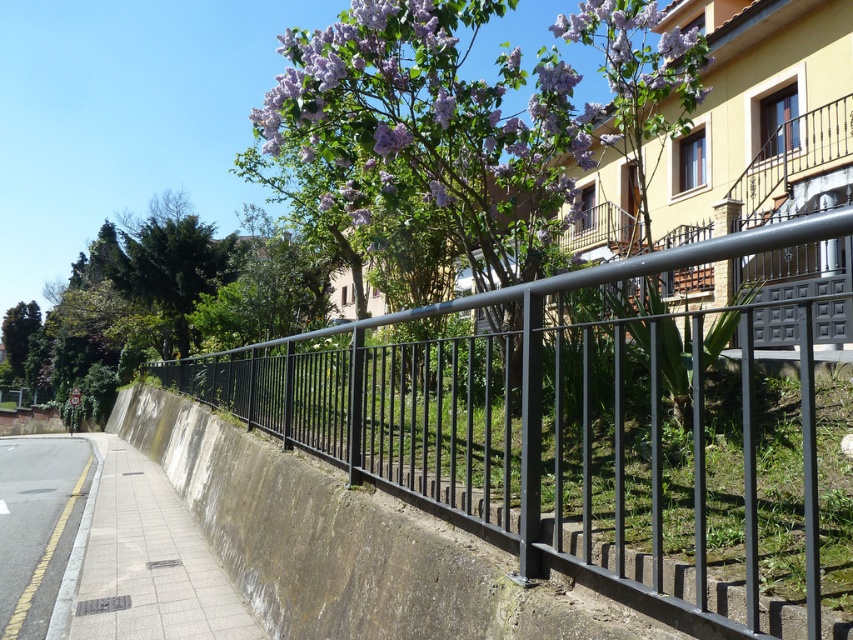
Question: Does purple flowering tree at center have a greater width compared to gray concrete pavement at lower left?

Choices:
 (A) no
 (B) yes

Answer: (B)

Question: Estimate the real-world distances between objects in this image. Which object is closer to the purple matte flower at upper center?

Choices:
 (A) gray concrete pavement at lower left
 (B) black metal fence at center
 (C) purple flowering tree at center

Answer: (B)

Question: Can you confirm if gray concrete pavement at lower left is positioned to the right of yellow painted concrete pavement at lower left?

Choices:
 (A) yes
 (B) no

Answer: (A)

Question: Which object appears farthest from the camera in this image?

Choices:
 (A) green leafy tree at upper left
 (B) gray concrete pavement at lower left
 (C) purple flowering tree at center
 (D) black metal fence at center

Answer: (A)

Question: Does purple flowering tree at center lie in front of green leafy tree at upper left?

Choices:
 (A) no
 (B) yes

Answer: (B)

Question: Among these points, which one is farthest from the camera?

Choices:
 (A) (x=180, y=554)
 (B) (x=432, y=102)
 (C) (x=648, y=124)

Answer: (A)